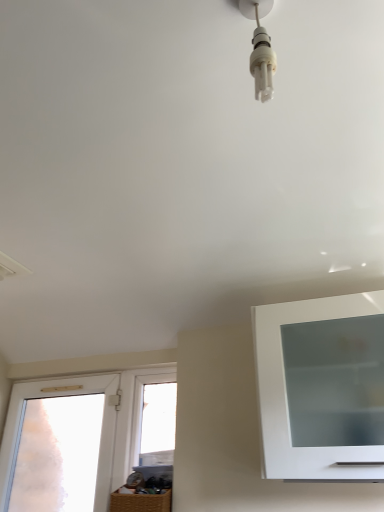
Question: Does transparent frosted glass door at left, the first window in the left-to-right sequence, have a lesser width compared to white plastic light bulb at upper center?

Choices:
 (A) no
 (B) yes

Answer: (B)

Question: Does transparent frosted glass door at left, the first window in the left-to-right sequence, have a greater height compared to white plastic light bulb at upper center?

Choices:
 (A) no
 (B) yes

Answer: (B)

Question: Is transparent frosted glass door at left, the first window in the left-to-right sequence, positioned beyond the bounds of white plastic light bulb at upper center?

Choices:
 (A) no
 (B) yes

Answer: (B)

Question: Can you confirm if transparent frosted glass door at left, the first window in the left-to-right sequence, is bigger than white plastic light bulb at upper center?

Choices:
 (A) yes
 (B) no

Answer: (A)

Question: Does transparent frosted glass door at left, the second window positioned from the right, contain white plastic light bulb at upper center?

Choices:
 (A) yes
 (B) no

Answer: (B)

Question: Considering their positions, is transparent glass window at center, the 1th window in the right-to-left sequence, located in front of or behind white plastic light bulb at upper center?

Choices:
 (A) front
 (B) behind

Answer: (B)

Question: Which is correct: transparent glass window at center, which ranks as the 2th window in left-to-right order, is inside white plastic light bulb at upper center, or outside of it?

Choices:
 (A) inside
 (B) outside

Answer: (B)

Question: From a real-world perspective, is transparent glass window at center, which ranks as the 2th window in left-to-right order, positioned above or below white plastic light bulb at upper center?

Choices:
 (A) above
 (B) below

Answer: (B)

Question: From their relative heights in the image, would you say transparent glass window at center, the 1th window in the right-to-left sequence, is taller or shorter than white plastic light bulb at upper center?

Choices:
 (A) short
 (B) tall

Answer: (B)

Question: Considering the positions of transparent glass window at center, the 1th window in the right-to-left sequence, and transparent frosted glass door at left, the first window in the left-to-right sequence, in the image, is transparent glass window at center, the 1th window in the right-to-left sequence, bigger or smaller than transparent frosted glass door at left, the first window in the left-to-right sequence,?

Choices:
 (A) big
 (B) small

Answer: (B)

Question: Is transparent glass window at center, which ranks as the 2th window in left-to-right order, taller or shorter than transparent frosted glass door at left, the first window in the left-to-right sequence?

Choices:
 (A) short
 (B) tall

Answer: (A)

Question: Is transparent glass window at center, the 1th window in the right-to-left sequence, wider or thinner than transparent frosted glass door at left, the second window positioned from the right?

Choices:
 (A) wide
 (B) thin

Answer: (B)

Question: Is point (142, 435) positioned closer to the camera than point (8, 474)?

Choices:
 (A) closer
 (B) farther

Answer: (A)

Question: Considering the positions of point (256, 9) and point (170, 372), is point (256, 9) closer or farther from the camera than point (170, 372)?

Choices:
 (A) farther
 (B) closer

Answer: (B)

Question: From the image's perspective, is white plastic light bulb at upper center located above or below transparent glass window at center, the 1th window in the right-to-left sequence?

Choices:
 (A) below
 (B) above

Answer: (B)